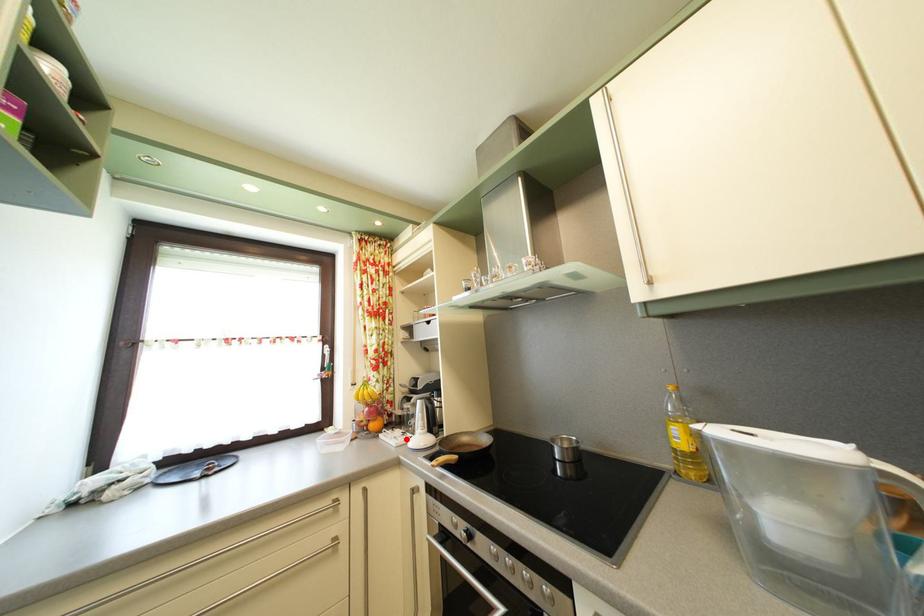
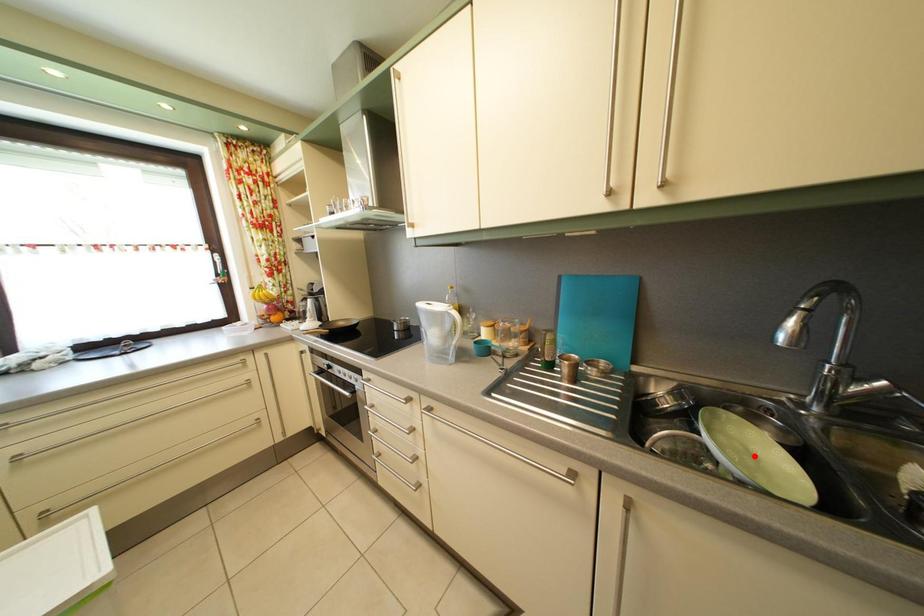
I am providing you with two images of the same scene from different viewpoints. A red point is marked on the first image and another point is marked on the second image. Do the highlighted points in image1 and image2 indicate the same real-world spot?

No